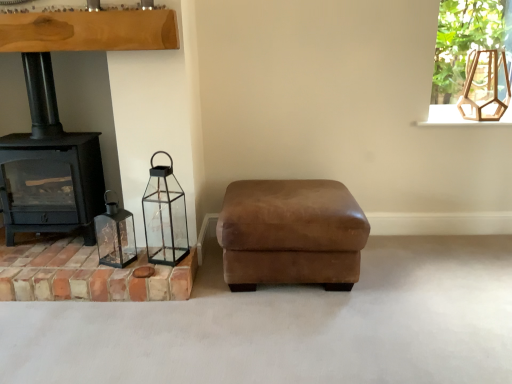
What do you see at coordinates (484, 86) in the screenshot? I see `wooden hexagonal lantern at upper right` at bounding box center [484, 86].

What do you see at coordinates (164, 216) in the screenshot? Image resolution: width=512 pixels, height=384 pixels. I see `black glass lantern at lower left, the 1th candle holder in the right-to-left sequence` at bounding box center [164, 216].

The image size is (512, 384). I want to click on brown suede ottoman at center, so click(291, 233).

Could you tell me if black glass lantern at lower left, the 1th candle holder in the right-to-left sequence, is facing brown suede ottoman at center?

No, black glass lantern at lower left, the 1th candle holder in the right-to-left sequence, is not facing towards brown suede ottoman at center.

From the image's perspective, which object appears higher, black glass lantern at lower left, the 1th candle holder in the right-to-left sequence, or brown suede ottoman at center?

From the image's view, black glass lantern at lower left, the 1th candle holder in the right-to-left sequence, is above.

From the image's perspective, which object appears higher, clear glass frame at upper right or terracotta brick at lower left?

clear glass frame at upper right, from the image's perspective.

Consider the image. Considering the relative sizes of clear glass frame at upper right and terracotta brick at lower left in the image provided, is clear glass frame at upper right shorter than terracotta brick at lower left?

No, clear glass frame at upper right is not shorter than terracotta brick at lower left.

From a real-world perspective, between clear glass frame at upper right and terracotta brick at lower left, who is vertically higher?

clear glass frame at upper right is physically above.

Does clear glass frame at upper right have a smaller size compared to terracotta brick at lower left?

Correct, clear glass frame at upper right occupies less space than terracotta brick at lower left.

Where is `wood burning stove on the left of the black glass lantern at lower left, positioned as the 2th candle holder in left-to-right order`? This screenshot has width=512, height=384. wood burning stove on the left of the black glass lantern at lower left, positioned as the 2th candle holder in left-to-right order is located at coordinates click(49, 166).

Would you say black cast iron wood burning stove at left is to the left or to the right of black glass lantern at lower left, positioned as the 2th candle holder in left-to-right order, in the picture?

In the image, black cast iron wood burning stove at left appears on the left side of black glass lantern at lower left, positioned as the 2th candle holder in left-to-right order.

Is black cast iron wood burning stove at left next to black glass lantern at lower left, positioned as the 2th candle holder in left-to-right order, and touching it?

black cast iron wood burning stove at left and black glass lantern at lower left, positioned as the 2th candle holder in left-to-right order, are clearly separated.

From a real-world perspective, is black glass lantern at lower left, the 1th candle holder in the right-to-left sequence, beneath terracotta brick at lower left?

No.

Which is farther, (163, 231) or (88, 248)?

Positioned behind is point (88, 248).

Based on their sizes in the image, would you say black glass lantern at lower left, positioned as the 2th candle holder in left-to-right order, is bigger or smaller than terracotta brick at lower left?

In the image, black glass lantern at lower left, positioned as the 2th candle holder in left-to-right order, appears to be smaller than terracotta brick at lower left.

Is the depth of black glass lantern at lower left, positioned as the 2th candle holder in left-to-right order, less than that of terracotta brick at lower left?

Yes, black glass lantern at lower left, positioned as the 2th candle holder in left-to-right order, is in front of terracotta brick at lower left.

Are wooden hexagonal lantern at upper right and terracotta brick at lower left making contact?

There is a gap between wooden hexagonal lantern at upper right and terracotta brick at lower left.

In the scene shown: Measure the distance between wooden hexagonal lantern at upper right and terracotta brick at lower left.

wooden hexagonal lantern at upper right and terracotta brick at lower left are 2.05 meters apart.

Consider the image. Which is more to the right, wooden hexagonal lantern at upper right or terracotta brick at lower left?

Positioned to the right is wooden hexagonal lantern at upper right.

Is wooden hexagonal lantern at upper right taller than terracotta brick at lower left?

Yes.

Where is `lamp above the brown suede ottoman at center (from a real-world perspective)`? Image resolution: width=512 pixels, height=384 pixels. lamp above the brown suede ottoman at center (from a real-world perspective) is located at coordinates coord(484,86).

Is brown suede ottoman at center situated inside wooden hexagonal lantern at upper right or outside?

brown suede ottoman at center is outside wooden hexagonal lantern at upper right.

Based on the photo, from the image's perspective, who appears lower, brown suede ottoman at center or wooden hexagonal lantern at upper right?

brown suede ottoman at center, from the image's perspective.

What's the angular difference between wooden hexagonal lantern at upper right and black cast iron wood burning stove at left's facing directions?

They differ by 0.847 degrees in their facing directions.

Considering the relative sizes of wooden hexagonal lantern at upper right and black cast iron wood burning stove at left in the image provided, is wooden hexagonal lantern at upper right taller than black cast iron wood burning stove at left?

In fact, wooden hexagonal lantern at upper right may be shorter than black cast iron wood burning stove at left.

Considering the positions of objects wooden hexagonal lantern at upper right and black cast iron wood burning stove at left in the image provided, who is more to the left, wooden hexagonal lantern at upper right or black cast iron wood burning stove at left?

Positioned to the left is black cast iron wood burning stove at left.

In the scene shown: Is wooden hexagonal lantern at upper right oriented away from black cast iron wood burning stove at left?

No, black cast iron wood burning stove at left is not at the back of wooden hexagonal lantern at upper right.

You are a GUI agent. You are given a task and a screenshot of the screen. Output one action in this format:
    pyautogui.click(x=<x>, y=<y>)
    Task: Click on the furniture that is in front of the black glass lantern at lower left, positioned as the 2th candle holder in left-to-right order
    Image resolution: width=512 pixels, height=384 pixels.
    Given the screenshot: What is the action you would take?
    pyautogui.click(x=291, y=233)

At what (x,y) coordinates should I click in order to perform the action: click on window frame that is on the right side of terracotta brick at lower left. Please return your answer as a coordinate pair (x, y). Looking at the image, I should click on click(472, 63).

Consider the image. From the image, which object appears to be nearer to black cast iron wood burning stove at left, wooden hexagonal lantern at upper right or brown suede ottoman at center?

Based on the image, brown suede ottoman at center appears to be nearer to black cast iron wood burning stove at left.

Looking at the image, which one is located further to matte glass lantern at left, arranged as the second candle holder when viewed from the right, black glass lantern at lower left, the 1th candle holder in the right-to-left sequence, or brown suede ottoman at center?

brown suede ottoman at center is further to matte glass lantern at left, arranged as the second candle holder when viewed from the right.

Estimate the real-world distances between objects in this image. Which object is closer to black glass lantern at lower left, positioned as the 2th candle holder in left-to-right order, clear glass frame at upper right or matte glass lantern at left, the 1th candle holder when ordered from left to right?

matte glass lantern at left, the 1th candle holder when ordered from left to right, lies closer to black glass lantern at lower left, positioned as the 2th candle holder in left-to-right order, than the other object.

From the image, which object appears to be nearer to terracotta brick at lower left, black glass lantern at lower left, the 1th candle holder in the right-to-left sequence, or clear glass frame at upper right?

black glass lantern at lower left, the 1th candle holder in the right-to-left sequence, lies closer to terracotta brick at lower left than the other object.

Based on their spatial positions, is black glass lantern at lower left, the 1th candle holder in the right-to-left sequence, or clear glass frame at upper right closer to brown suede ottoman at center?

black glass lantern at lower left, the 1th candle holder in the right-to-left sequence, is positioned closer to the anchor brown suede ottoman at center.

Which object lies nearer to the anchor point black cast iron wood burning stove at left, wooden hexagonal lantern at upper right or black glass lantern at lower left, the 1th candle holder in the right-to-left sequence?

black glass lantern at lower left, the 1th candle holder in the right-to-left sequence, is positioned closer to the anchor black cast iron wood burning stove at left.

Estimate the real-world distances between objects in this image. Which object is further from clear glass frame at upper right, brown suede ottoman at center or black glass lantern at lower left, positioned as the 2th candle holder in left-to-right order?

Among the two, black glass lantern at lower left, positioned as the 2th candle holder in left-to-right order, is located further to clear glass frame at upper right.

When comparing their distances from black glass lantern at lower left, positioned as the 2th candle holder in left-to-right order, does matte glass lantern at left, arranged as the second candle holder when viewed from the right, or terracotta brick at lower left seem closer?

matte glass lantern at left, arranged as the second candle holder when viewed from the right, lies closer to black glass lantern at lower left, positioned as the 2th candle holder in left-to-right order, than the other object.

At what (x,y) coordinates should I click in order to perform the action: click on lamp situated between matte glass lantern at left, arranged as the second candle holder when viewed from the right, and clear glass frame at upper right from left to right. Please return your answer as a coordinate pair (x, y). Looking at the image, I should click on (484, 86).

The width and height of the screenshot is (512, 384). In order to click on lamp between brown suede ottoman at center and clear glass frame at upper right in the horizontal direction in this screenshot , I will do `click(484, 86)`.

This screenshot has height=384, width=512. What are the coordinates of `brickwork between black cast iron wood burning stove at left and wooden hexagonal lantern at upper right in the horizontal direction` in the screenshot? It's located at (86, 275).

Where is `candle holder between matte glass lantern at left, arranged as the second candle holder when viewed from the right, and brown suede ottoman at center from left to right`? The height and width of the screenshot is (384, 512). candle holder between matte glass lantern at left, arranged as the second candle holder when viewed from the right, and brown suede ottoman at center from left to right is located at coordinates (164, 216).